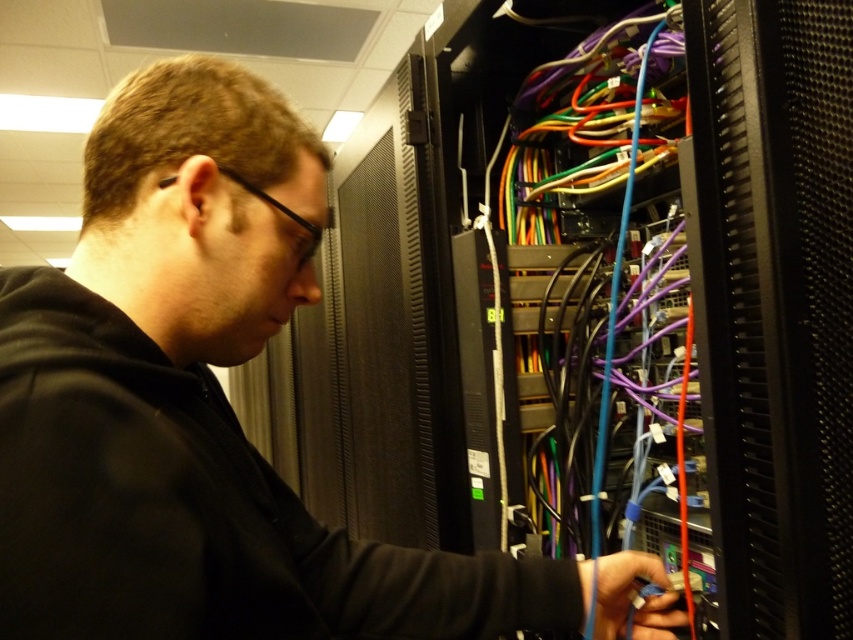
Question: Which point is farther to the camera?

Choices:
 (A) (161, 481)
 (B) (712, 314)

Answer: (B)

Question: Which point is closer to the camera taking this photo?

Choices:
 (A) (723, 536)
 (B) (187, 470)

Answer: (B)

Question: Does black matte jacket at center appear on the right side of black textured server at center?

Choices:
 (A) no
 (B) yes

Answer: (A)

Question: Does black matte jacket at center have a smaller size compared to black textured server at center?

Choices:
 (A) yes
 (B) no

Answer: (B)

Question: Is black matte jacket at center bigger than black textured server at center?

Choices:
 (A) no
 (B) yes

Answer: (B)